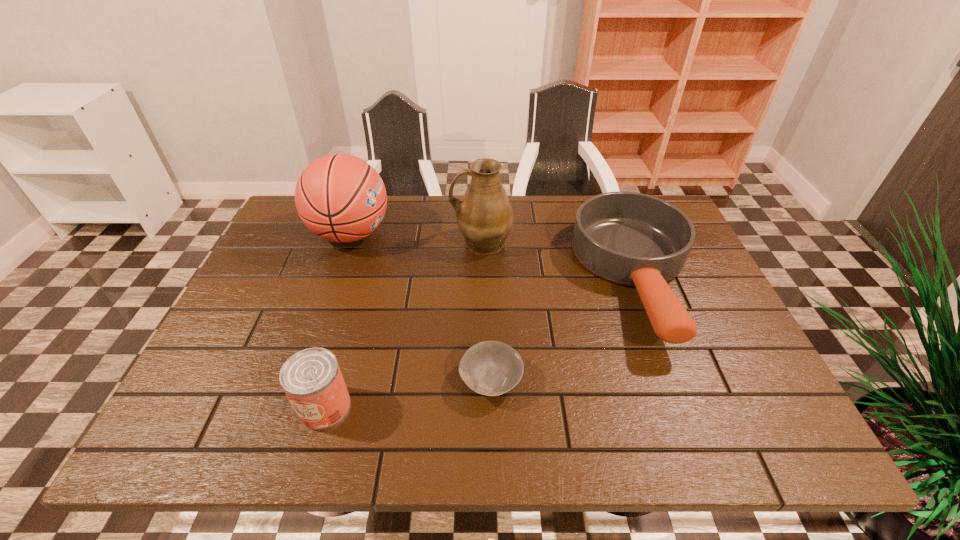
Identify the location of free region at the far edge. (514, 229).

This screenshot has width=960, height=540. In the image, there is a desktop. What are the coordinates of `vacant area at the near edge` in the screenshot? It's located at (555, 418).

Identify the location of vacant space at the left edge of the desktop. Image resolution: width=960 pixels, height=540 pixels. (220, 395).

At what (x,y) coordinates should I click in order to perform the action: click on blank area at the right edge. Please return your answer as a coordinate pair (x, y). The image size is (960, 540). Looking at the image, I should click on (735, 392).

Where is `vacant space at the near right corner of the desktop`? vacant space at the near right corner of the desktop is located at coordinates (725, 421).

I want to click on free spot between the rightmost object and the basketball, so click(x=493, y=256).

The width and height of the screenshot is (960, 540). In order to click on free space between the basketball and the pan in this screenshot , I will do `click(493, 256)`.

You are a GUI agent. You are given a task and a screenshot of the screen. Output one action in this format:
    pyautogui.click(x=<x>, y=<y>)
    Task: Click on the vacant space that's between the basketball and the shortest object
    The height and width of the screenshot is (540, 960).
    Given the screenshot: What is the action you would take?
    pyautogui.click(x=420, y=307)

Locate an element on the screen. free space that is in between the can and the pitcher is located at coordinates (403, 325).

The width and height of the screenshot is (960, 540). Identify the location of empty space between the pitcher and the bowl. (486, 311).